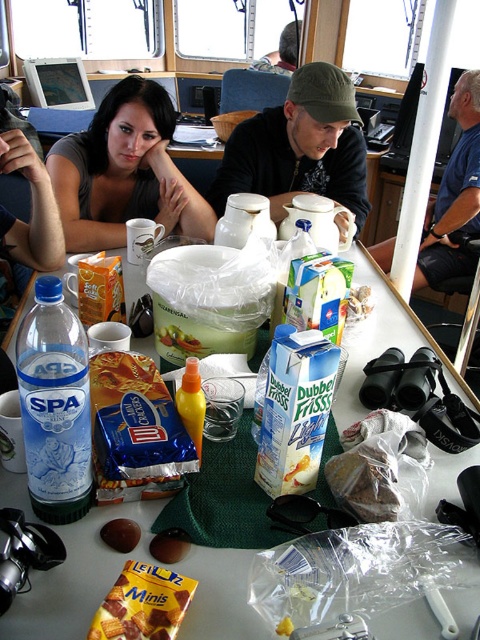
Question: Does matte black cap at upper center have a smaller size compared to yellow translucent bottle at center?

Choices:
 (A) yes
 (B) no

Answer: (B)

Question: Estimate the real-world distances between objects in this image. Which object is farther from the white plastic table at center?

Choices:
 (A) chocolate-coated wafer at center
 (B) yellow translucent bottle at center
 (C) matte plastic bottle at center-left

Answer: (B)

Question: Can you confirm if matte gray shirt at upper left is positioned above matte plastic bottle at center-left?

Choices:
 (A) yes
 (B) no

Answer: (A)

Question: Considering the relative positions of white plastic table at center and matte plastic bottle at center-left in the image provided, where is white plastic table at center located with respect to matte plastic bottle at center-left?

Choices:
 (A) left
 (B) right

Answer: (B)

Question: Which point appears closest to the camera in this image?

Choices:
 (A) (202, 403)
 (B) (118, 476)
 (C) (462, 140)

Answer: (B)

Question: Which object appears farthest from the camera in this image?

Choices:
 (A) matte black cap at upper center
 (B) chocolate-coated wafer at center

Answer: (A)